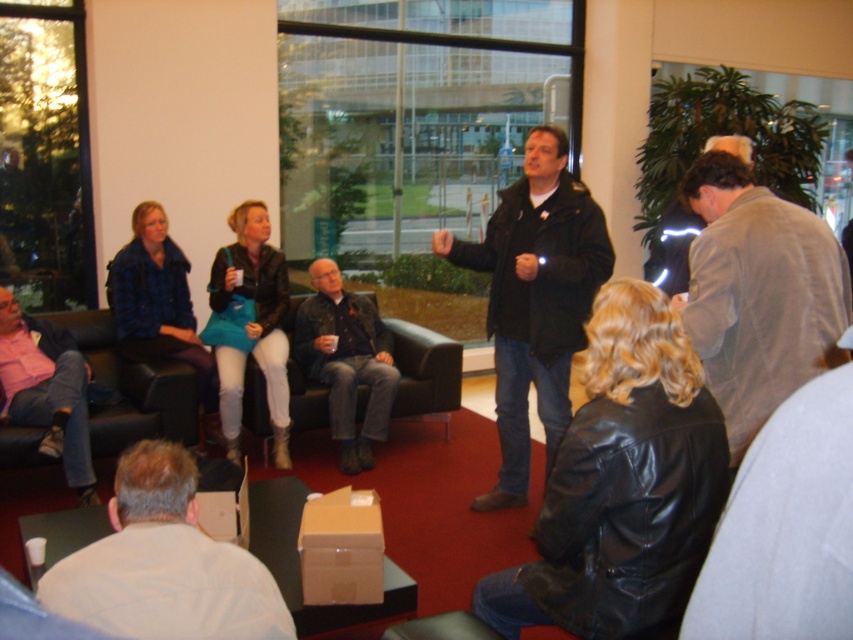
Who is taller, denim jacket at center or light gray fabric jacket at upper right?

denim jacket at center is taller.

Is denim jacket at center taller than light gray fabric jacket at upper right?

Yes.

Which is behind, point (358, 465) or point (686, 221)?

The point (358, 465) is behind.

Locate an element on the screen. The image size is (853, 640). denim jacket at center is located at coordinates (346, 362).

Measure the distance between point [782,365] and camera.

Point [782,365] and camera are 2.26 meters apart from each other.

What do you see at coordinates (758, 292) in the screenshot? The image size is (853, 640). I see `gray suede jacket at right` at bounding box center [758, 292].

Identify the location of gray suede jacket at right. The width and height of the screenshot is (853, 640). (758, 292).

Consider the image. Is the position of gray suede jacket at right more distant than that of denim jacket at center?

No.

Who is positioned more to the left, gray suede jacket at right or denim jacket at center?

denim jacket at center

Is point (750, 179) more distant than point (373, 364)?

No, it is in front of (373, 364).

Where is `gray suede jacket at right`? The image size is (853, 640). gray suede jacket at right is located at coordinates (758, 292).